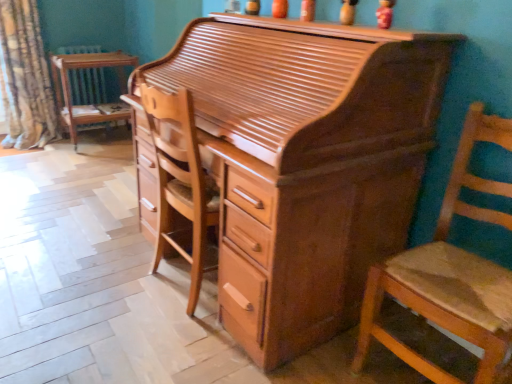
Question: From a real-world perspective, does wooden chair at right sit lower than shiny brown wood desk at center?

Choices:
 (A) no
 (B) yes

Answer: (B)

Question: Does wooden chair at right have a lesser height compared to shiny brown wood desk at center?

Choices:
 (A) no
 (B) yes

Answer: (B)

Question: Is wooden chair at right turned away from shiny brown wood desk at center?

Choices:
 (A) no
 (B) yes

Answer: (A)

Question: Can you confirm if wooden chair at right is bigger than shiny brown wood desk at center?

Choices:
 (A) yes
 (B) no

Answer: (B)

Question: Considering the relative positions of wooden chair at right and shiny brown wood desk at center in the image provided, is wooden chair at right behind shiny brown wood desk at center?

Choices:
 (A) yes
 (B) no

Answer: (B)

Question: From the image's perspective, is wooden chair at right under shiny brown wood desk at center?

Choices:
 (A) no
 (B) yes

Answer: (B)

Question: Can you confirm if wooden chair at right is wider than patterned fabric curtain at left?

Choices:
 (A) no
 (B) yes

Answer: (A)

Question: From a real-world perspective, is wooden chair at right beneath patterned fabric curtain at left?

Choices:
 (A) no
 (B) yes

Answer: (B)

Question: Is wooden chair at right at the right side of patterned fabric curtain at left?

Choices:
 (A) no
 (B) yes

Answer: (B)

Question: Does wooden chair at right turn towards patterned fabric curtain at left?

Choices:
 (A) no
 (B) yes

Answer: (A)

Question: From the image's perspective, does wooden chair at right appear lower than patterned fabric curtain at left?

Choices:
 (A) no
 (B) yes

Answer: (B)

Question: Are wooden chair at right and patterned fabric curtain at left located far from each other?

Choices:
 (A) yes
 (B) no

Answer: (A)

Question: Are wooden chair at right and wooden chair at left making contact?

Choices:
 (A) yes
 (B) no

Answer: (B)